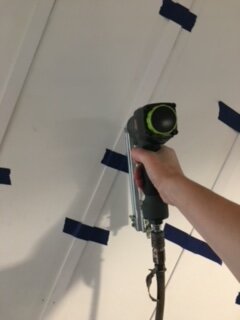
Identify the location of walls. This screenshot has height=320, width=240. (40, 238), (110, 266), (211, 292), (3, 24).